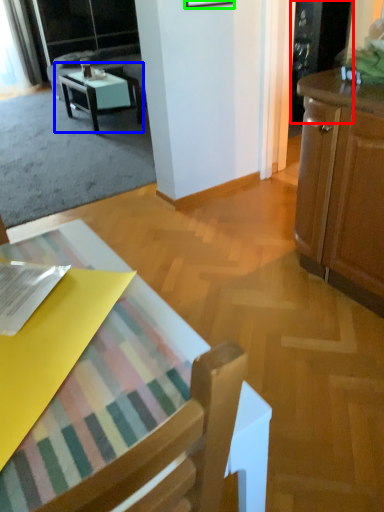
Question: Which object is the closest to the screen door (highlighted by a red box)? Choose among these: table (highlighted by a blue box) or picture frame (highlighted by a green box).

Choices:
 (A) table
 (B) picture frame

Answer: (B)